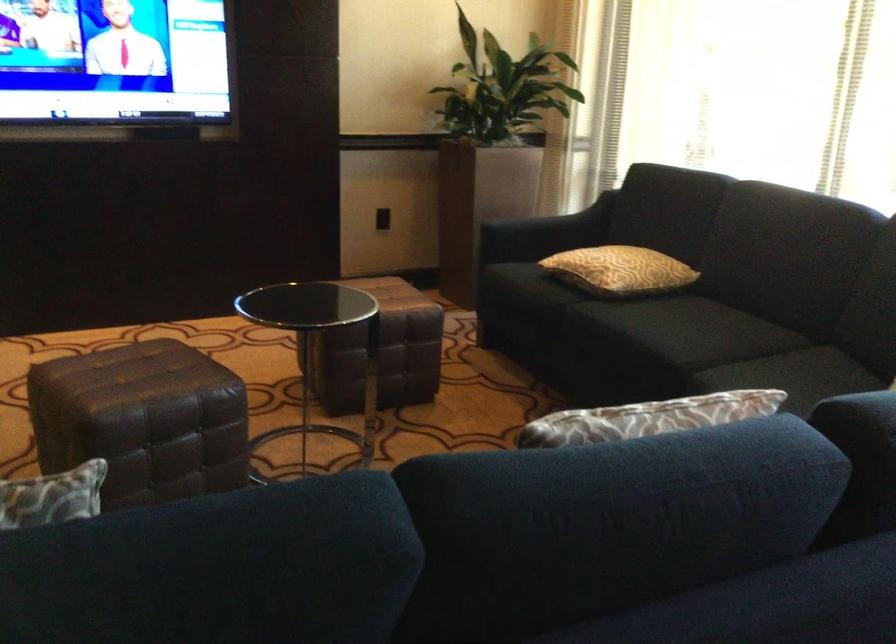
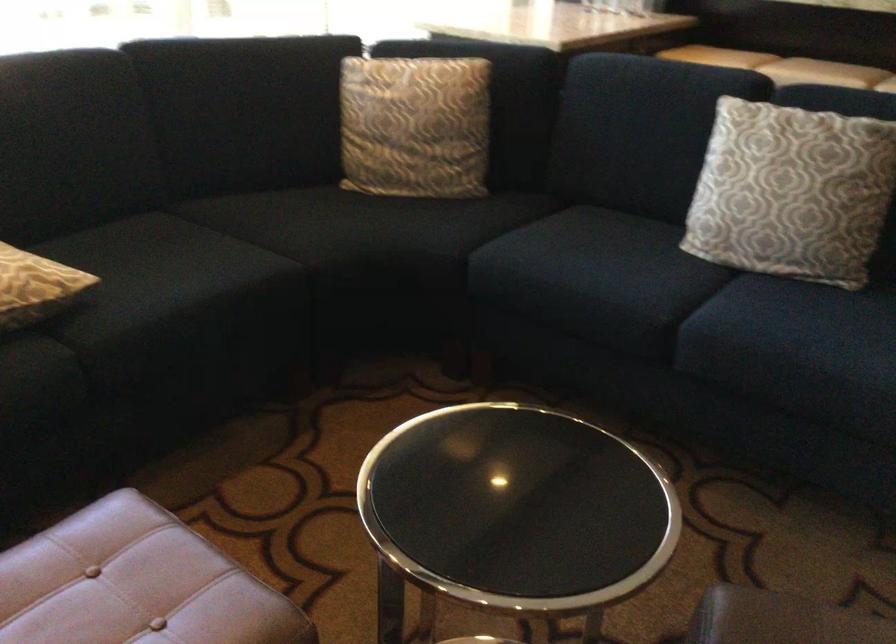
The point at (599, 272) is marked in the first image. Where is the corresponding point in the second image?

(35, 287)